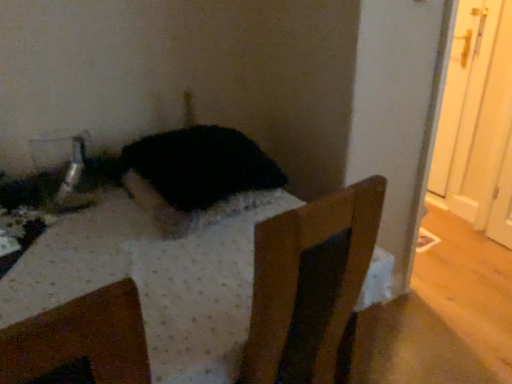
Image resolution: width=512 pixels, height=384 pixels. Describe the element at coordinates (192, 293) in the screenshot. I see `wooden chair at center` at that location.

In order to face wooden chair at center, should I rotate leftwards or rightwards?

Rotate your view left by about 10.219°.

Identify the location of wooden chair at center. The width and height of the screenshot is (512, 384). (192, 293).

What is the approximate width of black fur cat at center?

black fur cat at center is 17.51 inches wide.

Where is `black fur cat at center`? Image resolution: width=512 pixels, height=384 pixels. black fur cat at center is located at coordinates (196, 176).

Image resolution: width=512 pixels, height=384 pixels. What do you see at coordinates (196, 176) in the screenshot?
I see `black fur cat at center` at bounding box center [196, 176].

Find the location of a particular element. The height and width of the screenshot is (384, 512). wooden chair at center is located at coordinates (192, 293).

Based on the photo, between black fur cat at center and wooden chair at center, which one appears on the right side from the viewer's perspective?

black fur cat at center is more to the right.

Which is in front, black fur cat at center or wooden chair at center?

wooden chair at center is in front.

Which is closer, (256, 154) or (237, 278)?

The point (237, 278) is closer to the camera.

From the image's perspective, between black fur cat at center and wooden chair at center, which one is located above?

black fur cat at center, from the image's perspective.

From a real-world perspective, which object stands above the other?

black fur cat at center.

Does black fur cat at center have a lesser width compared to wooden chair at center?

Yes, black fur cat at center is thinner than wooden chair at center.

Considering the relative sizes of black fur cat at center and wooden chair at center in the image provided, is black fur cat at center shorter than wooden chair at center?

Yes.

Between black fur cat at center and wooden chair at center, which one has larger size?

Bigger between the two is wooden chair at center.

Which is correct: black fur cat at center is inside wooden chair at center, or outside of it?

black fur cat at center cannot be found inside wooden chair at center.

Is black fur cat at center placed right next to wooden chair at center?

No, black fur cat at center is not beside wooden chair at center.

Is black fur cat at center facing away from wooden chair at center?

No, wooden chair at center is not at the back of black fur cat at center.

Measure the distance from black fur cat at center to wooden chair at center.

black fur cat at center and wooden chair at center are 9.53 inches apart.

Where is `animal above the wooden chair at center (from the image's perspective)`? The width and height of the screenshot is (512, 384). animal above the wooden chair at center (from the image's perspective) is located at coordinates (196, 176).

Considering the relative positions of wooden chair at center and black fur cat at center in the image provided, is wooden chair at center to the left of black fur cat at center from the viewer's perspective?

Yes.

Is the position of wooden chair at center less distant than that of black fur cat at center?

Yes, wooden chair at center is closer to the camera.

Which is behind, point (129, 237) or point (170, 168)?

The point (170, 168) is behind.

From the image's perspective, which one is positioned higher, wooden chair at center or black fur cat at center?

black fur cat at center.

From a real-world perspective, is wooden chair at center located higher than black fur cat at center?

No, from a real-world perspective, wooden chair at center is not over black fur cat at center

Does wooden chair at center have a greater width compared to black fur cat at center?

Correct, the width of wooden chair at center exceeds that of black fur cat at center.

Can you confirm if wooden chair at center is shorter than black fur cat at center?

In fact, wooden chair at center may be taller than black fur cat at center.

Is wooden chair at center smaller than black fur cat at center?

No.

Is wooden chair at center inside the boundaries of black fur cat at center, or outside?

wooden chair at center is spatially situated outside black fur cat at center.

Is wooden chair at center next to black fur cat at center?

wooden chair at center and black fur cat at center are not in contact.

Does wooden chair at center turn towards black fur cat at center?

No, wooden chair at center is not oriented towards black fur cat at center.

What's the angular difference between wooden chair at center and black fur cat at center's facing directions?

wooden chair at center and black fur cat at center are facing 1.81 degrees away from each other.

Measure the distance from wooden chair at center to black fur cat at center.

wooden chair at center and black fur cat at center are 24.21 centimeters apart from each other.

Locate an element on the screen. furniture below the black fur cat at center (from the image's perspective) is located at coordinates (192, 293).

At what (x,y) coordinates should I click in order to perform the action: click on furniture to the left of black fur cat at center. Please return your answer as a coordinate pair (x, y). Image resolution: width=512 pixels, height=384 pixels. Looking at the image, I should click on (192, 293).

This screenshot has width=512, height=384. Find the location of `animal located behind the wooden chair at center`. animal located behind the wooden chair at center is located at coordinates (196, 176).